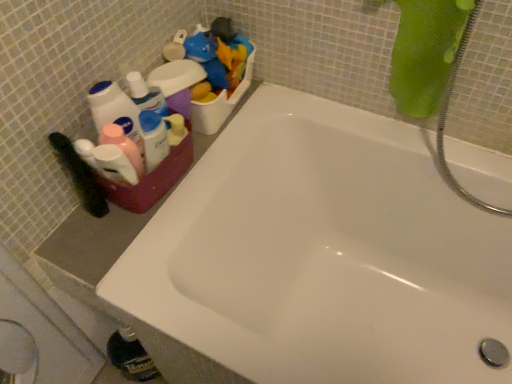
Question: Should I look upward or downward to see white glossy bathtub at center?

Choices:
 (A) up
 (B) down

Answer: (B)